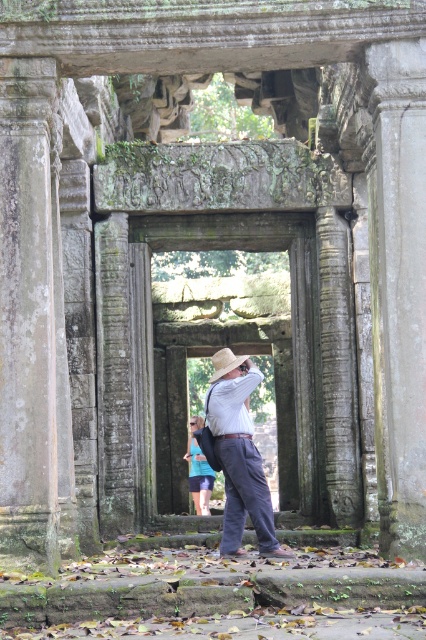
You are standing in front of the ancient stone structure and want to take a photo. There are two points marked on your camera screen at coordinates point (233, 372) and point (184, 458). Which point is nearer to you?

Point (233, 372) is closer to the viewer than point (184, 458).

You are standing at the entrance of the ancient stone structure and want to take a photo of the light brown straw hat at center. According to the scene description, where exactly is the hat positioned?

The light brown straw hat at center is located at point [239,454].

You are a photographer standing in front of the ancient stone structure. You have two hats, a light brown straw hat at center and a natural straw cowboy hat at center. Which hat is closer to the camera lens when you look through it?

The light brown straw hat at center is closer to the camera lens because it is in front of the natural straw cowboy hat at center.